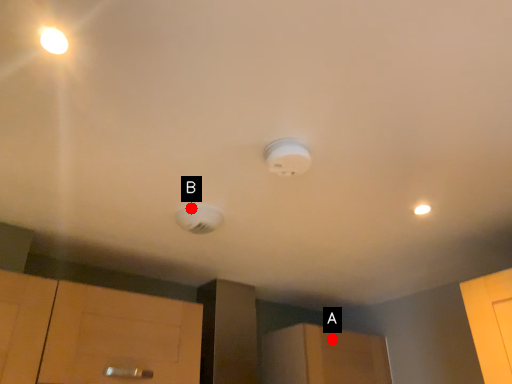
Question: Two points are circled on the image, labeled by A and B beside each circle. Which point appears closest to the camera in this image?

Choices:
 (A) A is closer
 (B) B is closer

Answer: (B)